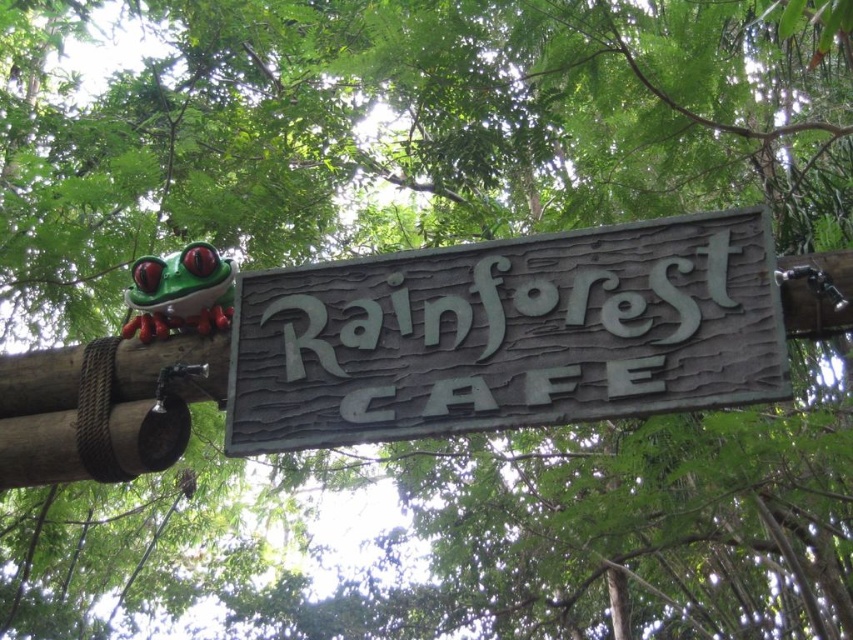
Question: Does green wood sign at center appear under green matte/frosted glass frog at upper left?

Choices:
 (A) yes
 (B) no

Answer: (A)

Question: Which point is farther to the camera?

Choices:
 (A) (177, 266)
 (B) (248, 422)

Answer: (A)

Question: Which of the following is the farthest from the observer?

Choices:
 (A) green matte/frosted glass frog at upper left
 (B) green wood sign at center

Answer: (A)

Question: Where is green wood sign at center located in relation to green matte/frosted glass frog at upper left in the image?

Choices:
 (A) above
 (B) below

Answer: (B)

Question: Is green wood sign at center to the left of green matte/frosted glass frog at upper left from the viewer's perspective?

Choices:
 (A) no
 (B) yes

Answer: (A)